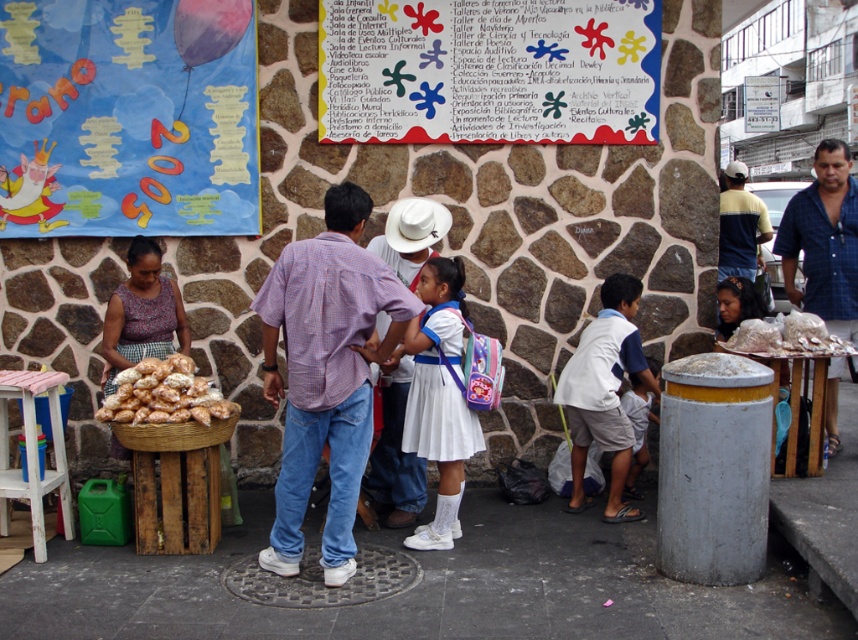
Is plaid cotton shirt at center further to the viewer compared to white matte dress at center?

No.

Describe the element at coordinates (325, 372) in the screenshot. The image size is (858, 640). I see `plaid cotton shirt at center` at that location.

You are a GUI agent. You are given a task and a screenshot of the screen. Output one action in this format:
    pyautogui.click(x=<x>, y=<y>)
    Task: Click on the plaid cotton shirt at center
    This screenshot has height=640, width=858.
    Given the screenshot: What is the action you would take?
    pyautogui.click(x=325, y=372)

Can you confirm if printed fabric skirt at lower left is thinner than white crumbly bread at right?

Yes.

Does printed fabric skirt at lower left lie in front of white crumbly bread at right?

No, printed fabric skirt at lower left is behind white crumbly bread at right.

Which is in front, point (180, 321) or point (760, 339)?

Point (760, 339) is in front.

Locate an element on the screen. printed fabric skirt at lower left is located at coordinates (142, 314).

Between white paper with colorful paint splatters at upper center and brown woven basket at lower left, which one is positioned higher?

Positioned higher is white paper with colorful paint splatters at upper center.

Is point (654, 108) in front of point (190, 420)?

No, it is behind (190, 420).

You are a GUI agent. You are given a task and a screenshot of the screen. Output one action in this format:
    pyautogui.click(x=<x>, y=<y>)
    Task: Click on the white paper with colorful paint splatters at upper center
    
    Given the screenshot: What is the action you would take?
    pyautogui.click(x=488, y=70)